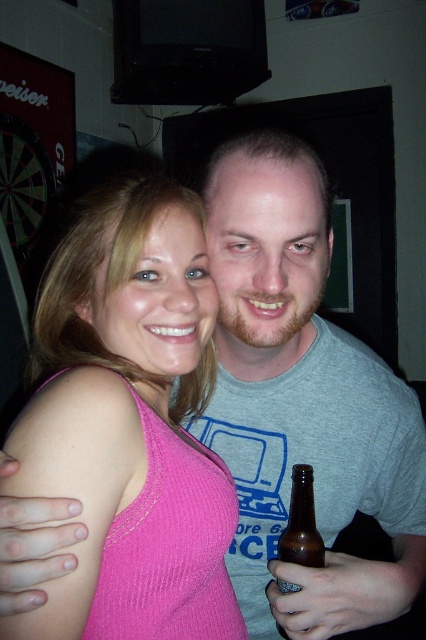
Question: Which object is farther from the camera taking this photo?

Choices:
 (A) gray cotton t-shirt at center
 (B) brown glass bottle at lower right
 (C) pink ribbed tank top at center

Answer: (B)

Question: Is gray cotton t-shirt at center to the right of brown glass bottle at lower right from the viewer's perspective?

Choices:
 (A) no
 (B) yes

Answer: (B)

Question: Which point appears farthest from the camera in this image?

Choices:
 (A) (138, 480)
 (B) (310, 493)
 (C) (345, 356)

Answer: (C)

Question: Does gray cotton t-shirt at center lie behind brown glass bottle at lower right?

Choices:
 (A) no
 (B) yes

Answer: (A)

Question: Based on their relative distances, which object is nearer to the gray cotton t-shirt at center?

Choices:
 (A) pink ribbed tank top at center
 (B) brown glass bottle at lower right

Answer: (A)

Question: From the image, what is the correct spatial relationship of gray cotton t-shirt at center in relation to brown glass bottle at lower right?

Choices:
 (A) left
 (B) right

Answer: (B)